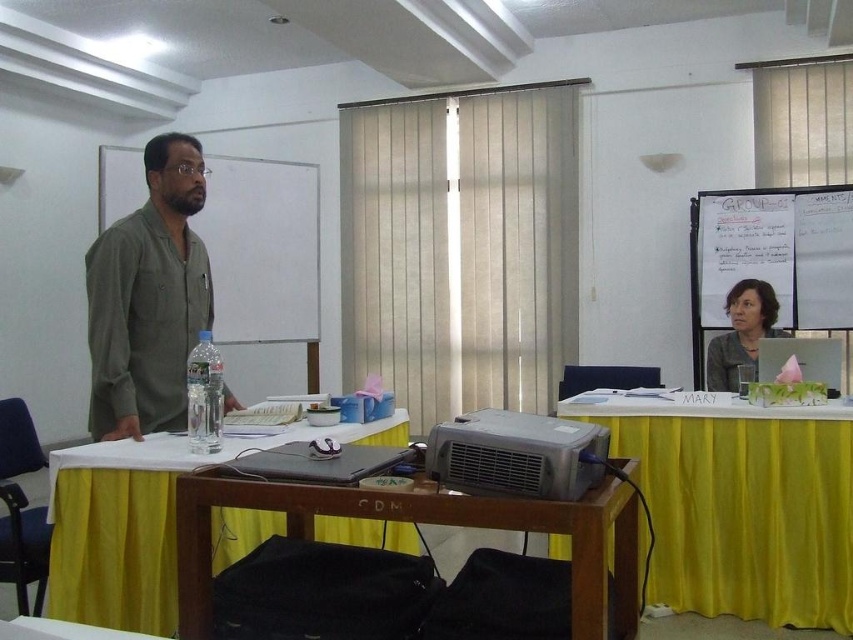
Question: Can you confirm if yellow fabric table at center is bigger than pink paper napkin at upper right?

Choices:
 (A) no
 (B) yes

Answer: (B)

Question: Does yellow fabric table at lower right lie in front of brown wooden table at center?

Choices:
 (A) yes
 (B) no

Answer: (B)

Question: Which point is farther to the camera?

Choices:
 (A) (767, 198)
 (B) (135, 538)
 (C) (780, 353)

Answer: (A)

Question: Estimate the real-world distances between objects in this image. Which object is closer to the yellow fabric table at center?

Choices:
 (A) green matte shirt at left
 (B) white matte board at upper center
 (C) yellow fabric table at lower right
 (D) silver metallic projector at center

Answer: (A)

Question: Can you confirm if white matte board at upper center is positioned above black matte laptop at center?

Choices:
 (A) yes
 (B) no

Answer: (A)

Question: Which object is the closest to the green matte shirt at left?

Choices:
 (A) brown wooden table at center
 (B) pink paper napkin at upper right

Answer: (A)